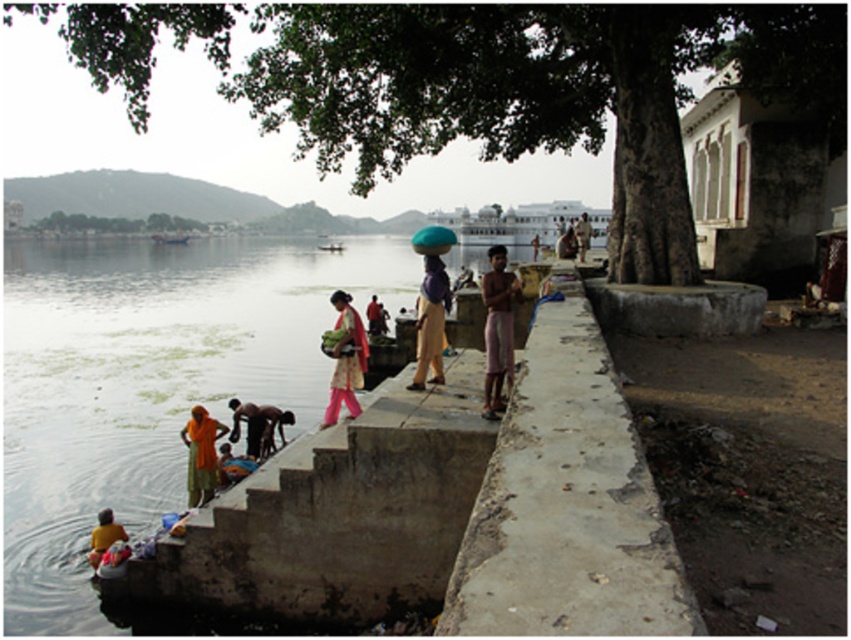
In the scene shown: Who is positioned more to the left, purple fabric bag at center or yellow fabric at lower left?

Positioned to the left is yellow fabric at lower left.

Which of these two, purple fabric bag at center or yellow fabric at lower left, stands taller?

purple fabric bag at center

Which is behind, point (444, 280) or point (107, 515)?

Positioned behind is point (444, 280).

What are the coordinates of `purple fabric bag at center` in the screenshot? It's located at (431, 323).

Does pink cotton shorts at center appear on the right side of yellow fabric at lower left?

Indeed, pink cotton shorts at center is positioned on the right side of yellow fabric at lower left.

Is point (487, 397) closer to camera compared to point (101, 515)?

Yes.

Between point (507, 340) and point (101, 538), which one is positioned behind?

Point (101, 538)

Locate an element on the screen. The width and height of the screenshot is (851, 640). pink cotton shorts at center is located at coordinates (497, 330).

Can you confirm if pink cotton shorts at center is thinner than purple fabric bag at center?

Incorrect, pink cotton shorts at center's width is not less than purple fabric bag at center's.

Which is in front, point (498, 348) or point (441, 262)?

Point (498, 348)

This screenshot has width=851, height=640. I want to click on pink cotton shorts at center, so click(497, 330).